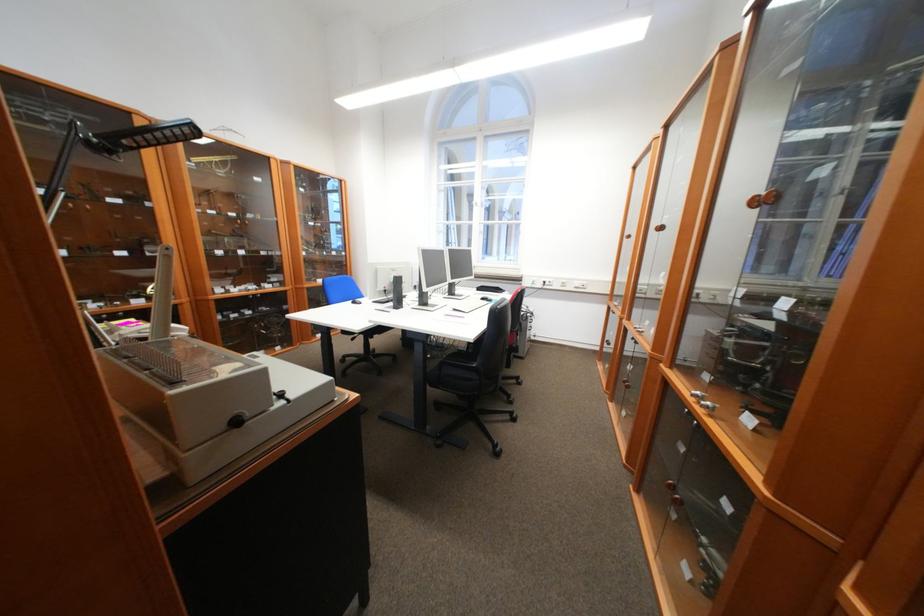
Where would you push the machine lever handle? Please return your answer as a coordinate pair (x, y).

(282, 395)